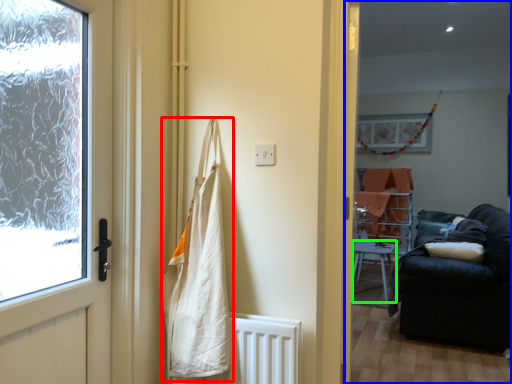
Question: Which object is the closest to the shopping bag (highlighted by a red box)? Choose among these: corridor (highlighted by a blue box) or furniture (highlighted by a green box).

Choices:
 (A) corridor
 (B) furniture

Answer: (B)